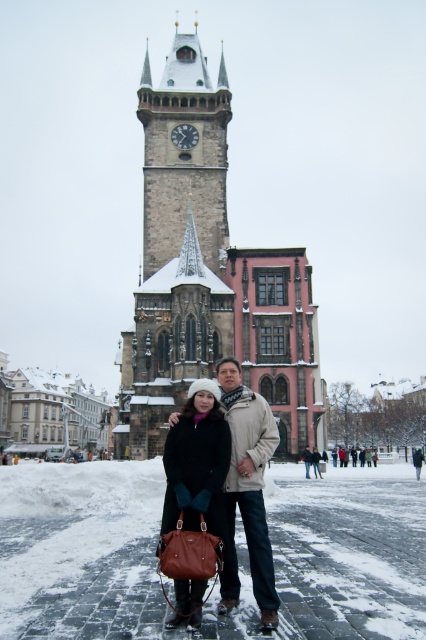
Based on the photo, you are a photographer trying to capture a clear shot of the beige wool scarf at center while focusing on the matte black coat at center. Since the scarf is part of the person wearing the coat, will you need to adjust your camera focus to ensure both are in focus?

The matte black coat at center is located above the beige wool scarf at center, so if the camera is focused on the coat, the scarf should also be in focus as they are part of the same person and close in proximity.

You are a photographer standing at the point with coordinates point (308, 452) and want to take a photo of the clock tower. To ensure both points are visible in the frame, which direction should you move relative to point (189, 209)?

Since point (189, 209) is behind point (308, 452), you should move backward away from the clock tower to include both points in the frame.